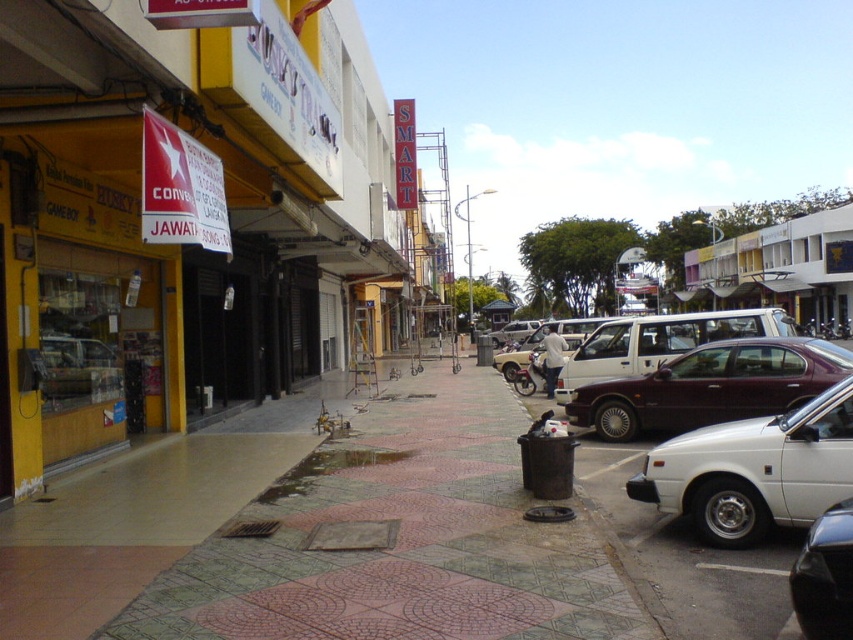
You are a delivery person trying to park your 1.2 meter wide delivery cart on the polished concrete sidewalk at center. Considering the yellow matte building at center is wider than the sidewalk, can you safely park your cart there?

The yellow matte building at center is wider than the polished concrete sidewalk at center, so the sidewalk might not have enough space for the 1.2 meter wide delivery cart. Check the available space before parking.

Consider the image. You are a delivery person with a cart that is 5 meters wide. You need to navigate between the yellow matte building at center and the nearest object to it. Can your cart fit through the space between them?

The yellow matte building at center and the nearest object are 5.19 meters apart. Since your cart is 5 meters wide, it can fit through the space between them as the distance is slightly larger than the cart.